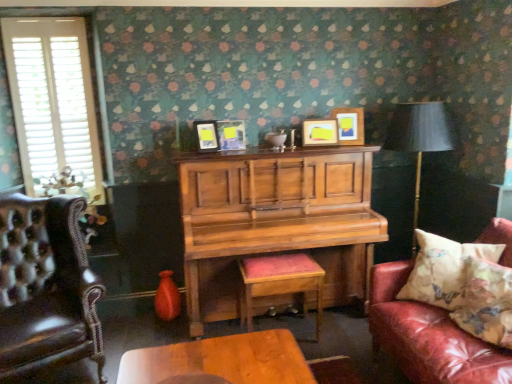
The height and width of the screenshot is (384, 512). Identify the location of vacant area that is in front of matte black picture frame at center, arranged as the 3th picture frame when viewed from the right. (231, 155).